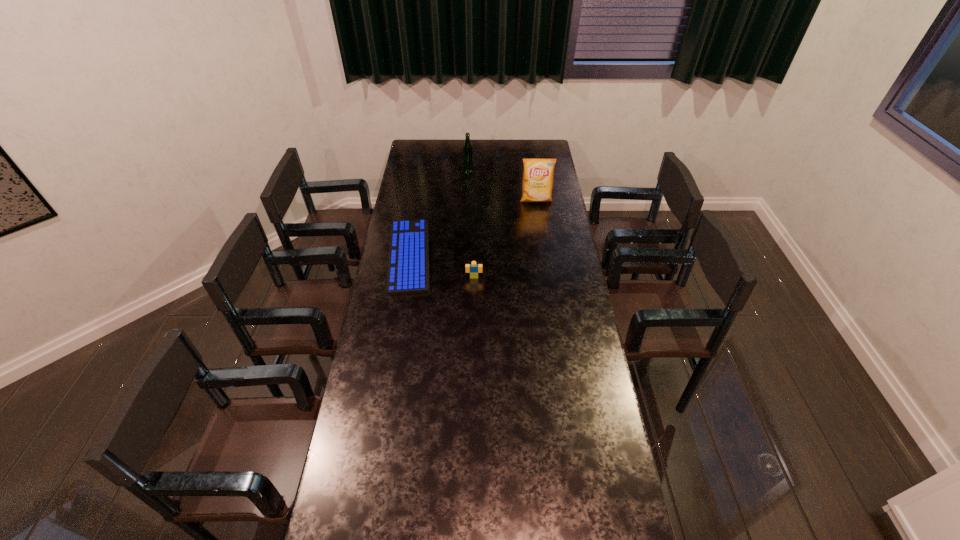
Locate an element on the screen. This screenshot has height=540, width=960. free space between the second farthest object and the leftmost object is located at coordinates point(472,228).

In order to click on empty space between the computer keyboard and the beer bottle in this screenshot , I will do `click(439, 211)`.

The image size is (960, 540). In order to click on unoccupied area between the third tallest object and the second farthest object in this screenshot , I will do `click(505, 239)`.

Identify the location of unoccupied area between the crisp (potato chip) and the computer keyboard. (472, 228).

The height and width of the screenshot is (540, 960). What are the coordinates of `object that is the third nearest to the beer bottle` in the screenshot? It's located at (473, 268).

At what (x,y) coordinates should I click in order to perform the action: click on object that stands as the second closest to the farthest object. Please return your answer as a coordinate pair (x, y). The image size is (960, 540). Looking at the image, I should click on (408, 271).